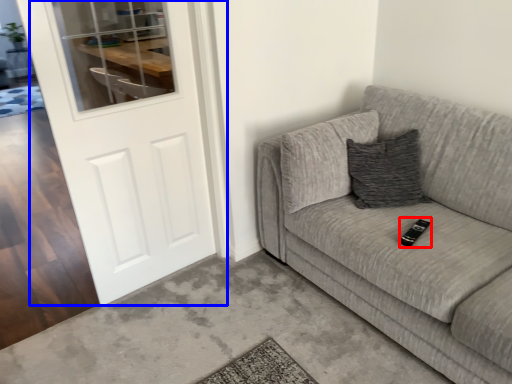
Question: Which object is closer to the camera taking this photo, remote (highlighted by a red box) or door (highlighted by a blue box)?

Choices:
 (A) remote
 (B) door

Answer: (B)